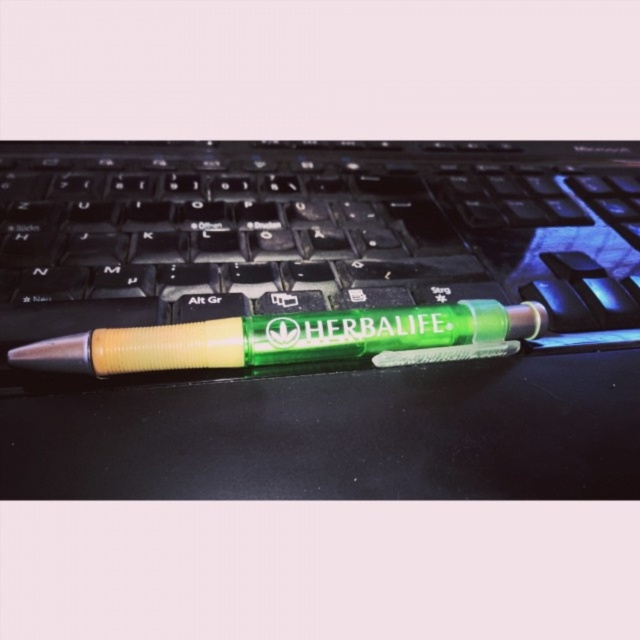
Question: Which point is farther to the camera?

Choices:
 (A) (189, 291)
 (B) (48, 340)

Answer: (A)

Question: Considering the relative positions of transparent plastic pen at center and translucent green pen at center in the image provided, where is transparent plastic pen at center located with respect to translucent green pen at center?

Choices:
 (A) above
 (B) below

Answer: (A)

Question: Can you confirm if transparent plastic pen at center is positioned below translucent green pen at center?

Choices:
 (A) no
 (B) yes

Answer: (A)

Question: Which point is closer to the camera?

Choices:
 (A) (176, 326)
 (B) (61, 189)

Answer: (A)

Question: Among these objects, which one is farthest from the camera?

Choices:
 (A) transparent plastic pen at center
 (B) translucent green pen at center

Answer: (A)

Question: Can you confirm if transparent plastic pen at center is smaller than translucent green pen at center?

Choices:
 (A) no
 (B) yes

Answer: (A)